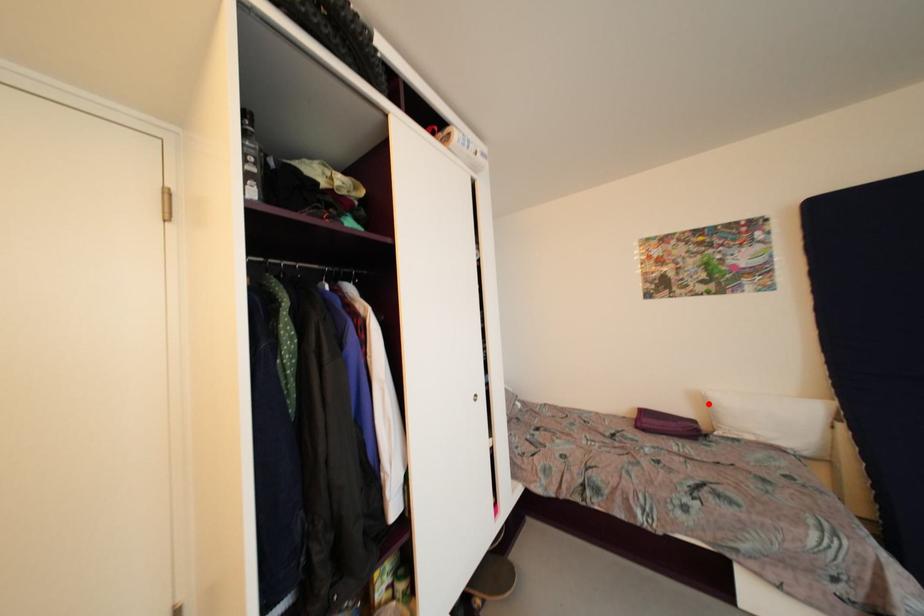
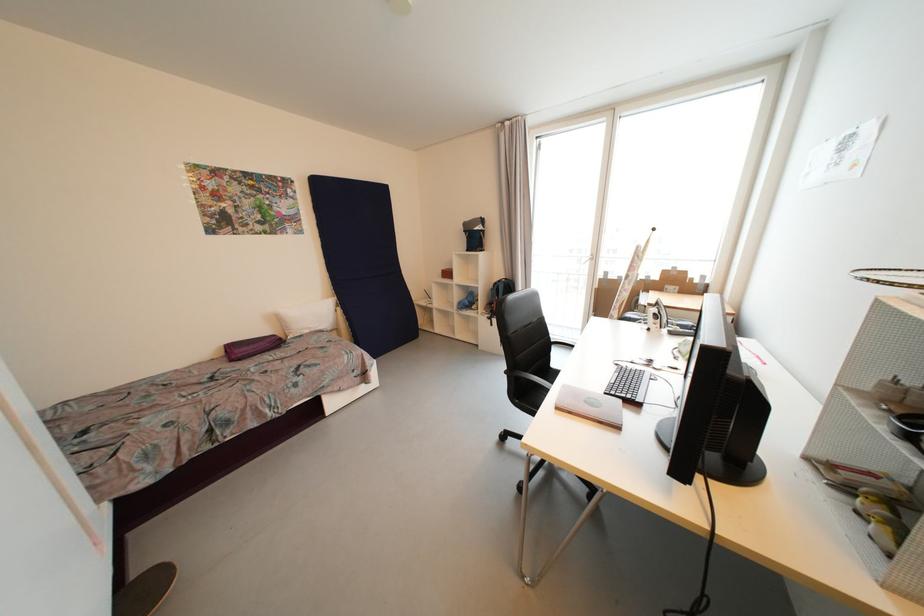
Question: I am providing you with two images of the same scene from different viewpoints. A red point is shown in image1. For the corresponding object point in image2, is it positioned nearer or farther from the camera?

Choices:
 (A) Nearer
 (B) Farther

Answer: (A)